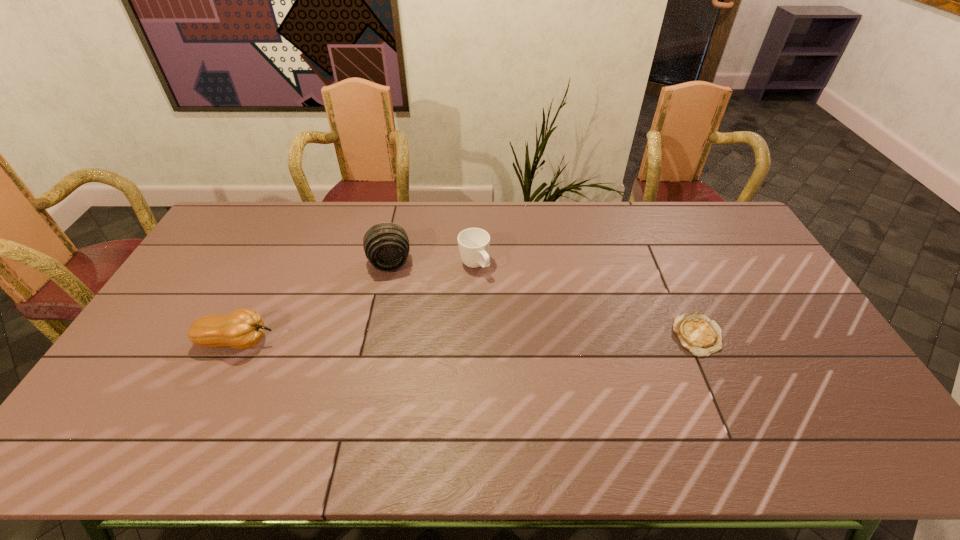
I want to click on object that is the second closest to the rightmost object, so pyautogui.click(x=386, y=245).

Find the location of a particular element. The width and height of the screenshot is (960, 540). free spot that satisfies the following two spatial constraints: 1. on the front side of the shortest object; 2. on the right side of the cup is located at coordinates (473, 335).

Where is `free location that satisfies the following two spatial constraints: 1. on the front side of the tallest object; 2. on the right side of the rightmost object`? The width and height of the screenshot is (960, 540). free location that satisfies the following two spatial constraints: 1. on the front side of the tallest object; 2. on the right side of the rightmost object is located at coordinates (373, 335).